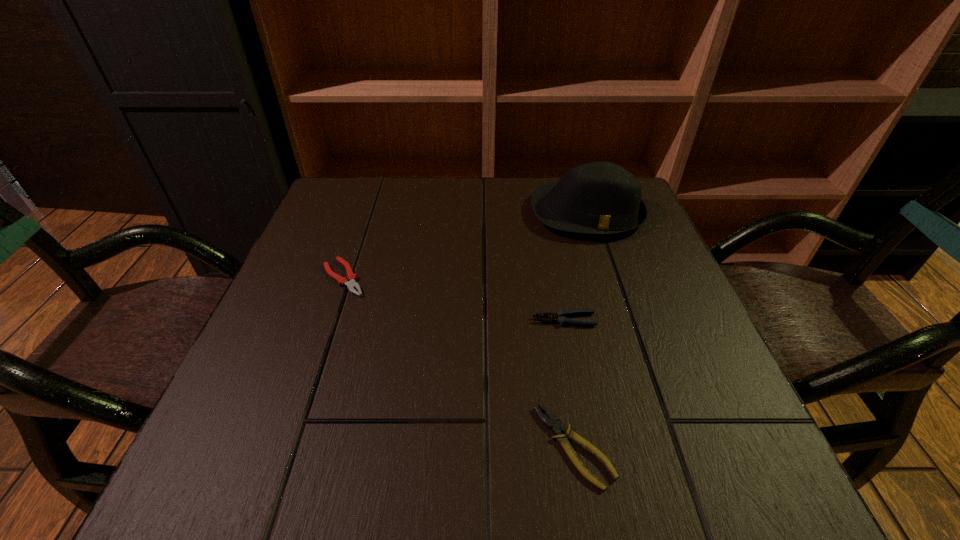
Locate an element on the screen. The width and height of the screenshot is (960, 540). vacant space located 0.370m at the gripping part of the second nearest pliers is located at coordinates (337, 320).

I want to click on free point located on the back of the leftmost object, so click(x=355, y=245).

Image resolution: width=960 pixels, height=540 pixels. What are the coordinates of `vacant space located on the right of the nearest object` in the screenshot? It's located at (644, 446).

At what (x,y) coordinates should I click in order to perform the action: click on object that is positioned at the far edge. Please return your answer as a coordinate pair (x, y). This screenshot has width=960, height=540. Looking at the image, I should click on (600, 198).

What are the coordinates of `object that is positioned at the near edge` in the screenshot? It's located at (554, 424).

The image size is (960, 540). I want to click on object situated at the left edge, so click(x=352, y=277).

Where is `object at the right edge`? The width and height of the screenshot is (960, 540). object at the right edge is located at coordinates (600, 198).

Locate an element on the screen. Image resolution: width=960 pixels, height=540 pixels. object positioned at the far right corner is located at coordinates (600, 198).

I want to click on free space at the near edge of the desktop, so click(x=372, y=470).

Where is `vacant space at the left edge`? Image resolution: width=960 pixels, height=540 pixels. vacant space at the left edge is located at coordinates (301, 274).